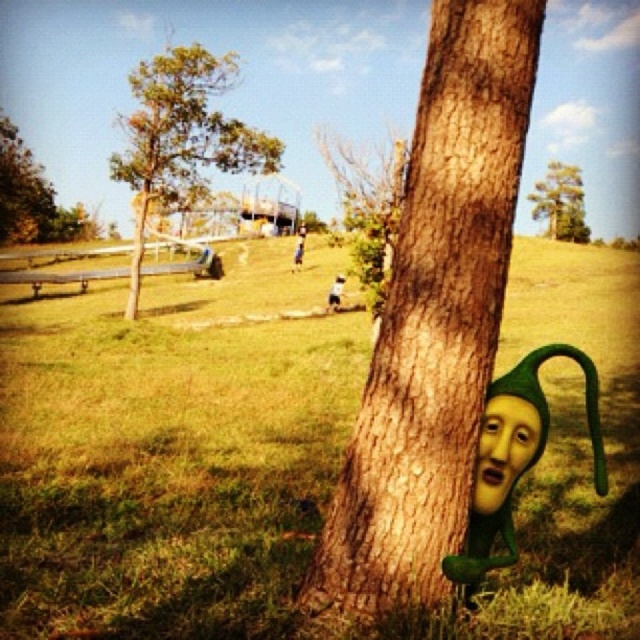
You are a photographer standing in the park and want to take a photo that includes both the brown rough bark tree at center and the green matte tree at upper left. Which tree will appear larger in the photo?

The brown rough bark tree at center will appear larger in the photo because it is closer to the viewer than the green matte tree at upper left.

You are standing in the park and want to take a photo of the brown rough tree trunk at center. If your camera can focus on objects up to 3 meters away, will you be able to take a clear photo?

The brown rough tree trunk at center and camera are 2.77 meters apart from each other, so yes, the camera can focus on the tree trunk since the distance is within the 3 meters limit.

Based on the photo, you are a painter standing in the park and want to paint the brown rough tree trunk at center and the green matte mask at lower right. Which object should you move closer to if you want to paint both subjects without moving your easel? Explain your reasoning.

The brown rough tree trunk at center is to the left of the green matte mask at lower right. Since the tree trunk is already positioned to the left of the mask, the painter should move closer to the green matte mask at lower right to ensure both subjects remain within the painting frame without adjusting the easel.